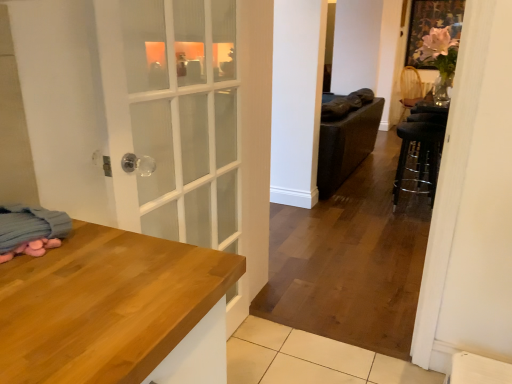
Image resolution: width=512 pixels, height=384 pixels. What are the coordinates of `free point in front of black metal bar stool at right` in the screenshot? It's located at click(403, 224).